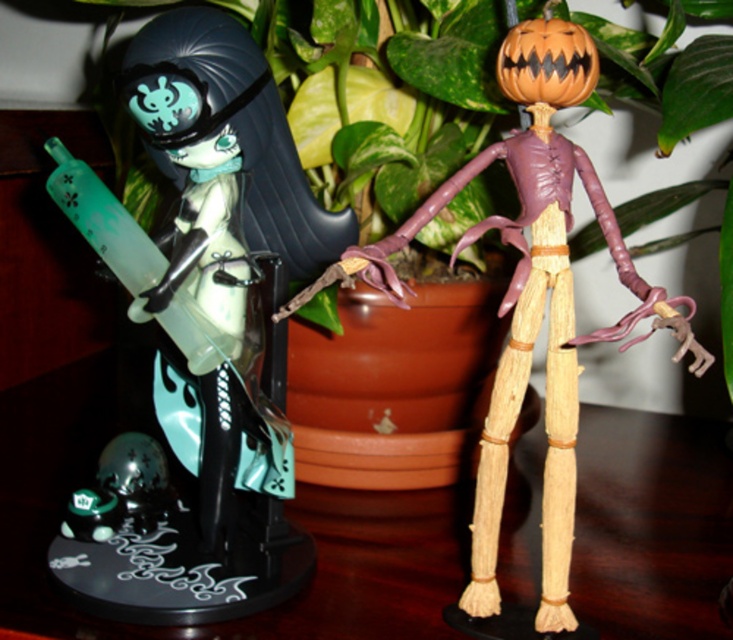
You are organizing a Halloween display and need to place the matte green plastic figure at left and the wooden skeleton at right on a shelf. The shelf has limited space, and you want to ensure that the larger item is placed first. Which figurine should you place first?

Answer: The matte green plastic figure at left is bigger than the wooden skeleton at right, so you should place the matte green plastic figure at left first to accommodate its size before placing the smaller wooden skeleton at right.

You are arranging a display and need to place a new item between the matte green plastic figure at left and the wooden skeleton at right. Can you confirm the direction you should place it to ensure it is between them?

The matte green plastic figure at left is to the left of the wooden skeleton at right, so placing the new item to the right of the matte green plastic figure at left and to the left of the wooden skeleton at right will position it between them.

You are setting up a display and need to arrange the matte green plastic figure at left and the wooden skeleton at right. If you want to place a small vase between them, where should you position it so it doesn

The matte green plastic figure at left is taller than the wooden skeleton at right. Therefore, you should position the vase between them at a height that accommodates both figures, ensuring it doesn